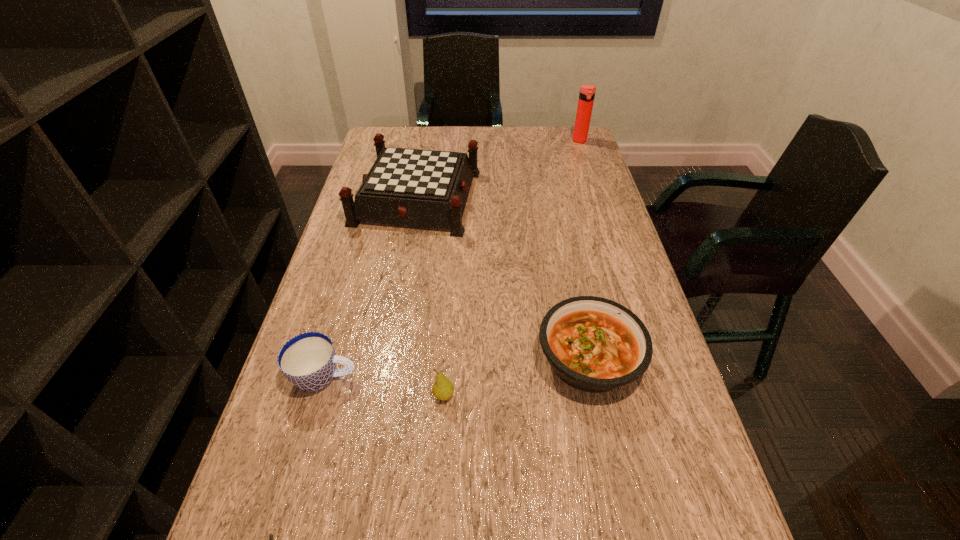
Find the location of `free space at the right edge of the desktop`. free space at the right edge of the desktop is located at coordinates (562, 204).

You are a GUI agent. You are given a task and a screenshot of the screen. Output one action in this format:
    pyautogui.click(x=<x>, y=<y>)
    Task: Click on the vacant space at the far right corner of the desktop
    Image resolution: width=960 pixels, height=540 pixels.
    Given the screenshot: What is the action you would take?
    pyautogui.click(x=564, y=140)

Where is `vacant space in between the farthest object and the checkerboard`? The height and width of the screenshot is (540, 960). vacant space in between the farthest object and the checkerboard is located at coordinates (498, 169).

You are a GUI agent. You are given a task and a screenshot of the screen. Output one action in this format:
    pyautogui.click(x=<x>, y=<y>)
    Task: Click on the vacant area that lies between the stew and the fifth shortest object
    The image size is (960, 540).
    Given the screenshot: What is the action you would take?
    pyautogui.click(x=503, y=278)

I want to click on free space between the second farthest object and the stew, so click(503, 278).

Locate an element on the screen. The height and width of the screenshot is (540, 960). free space between the tallest object and the cup is located at coordinates (452, 259).

The height and width of the screenshot is (540, 960). What are the coordinates of `empty location between the stew and the thermos bottle` in the screenshot? It's located at (585, 250).

The image size is (960, 540). What are the coordinates of `free spot between the farthest object and the stew` in the screenshot? It's located at (585, 250).

Identify the location of unoccupied position between the cup and the fifth shortest object. This screenshot has height=540, width=960. (371, 287).

This screenshot has height=540, width=960. Identify the location of unoccupied position between the checkerboard and the stew. (503, 278).